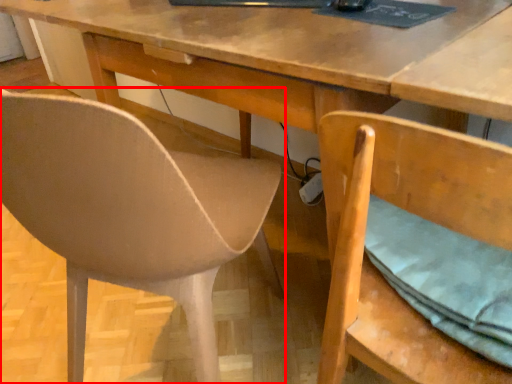
Question: From the image's perspective, where is chair (annotated by the red box) located relative to chair?

Choices:
 (A) below
 (B) above

Answer: (B)